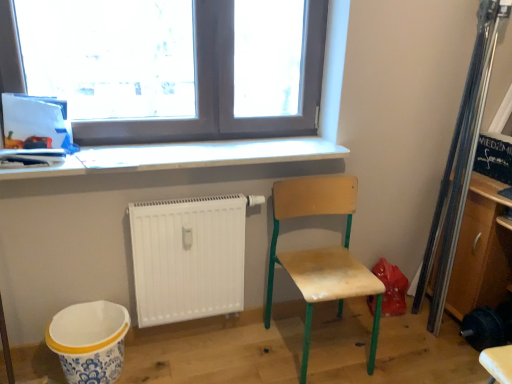
Where is `free spot above white glossy counter top at upper center (from a real-world perspective)`? Image resolution: width=512 pixels, height=384 pixels. free spot above white glossy counter top at upper center (from a real-world perspective) is located at coordinates (136, 151).